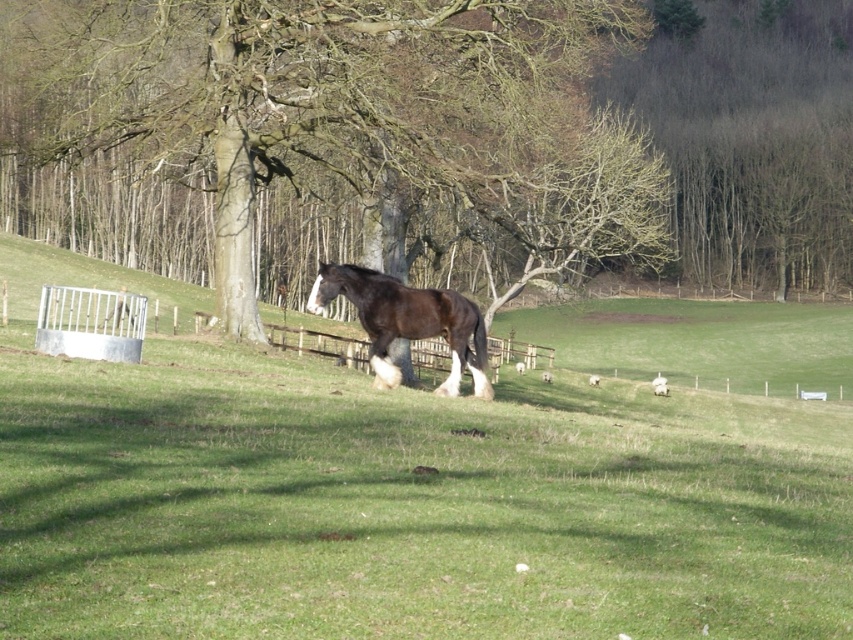
You are standing in the middle of the field and want to walk towards the horse. There are two points marked in the image, point0 at (x=474, y=134) and point1 at (x=410, y=307). Which point should you walk towards to get closer to the horse?

You should walk towards point0 at (x=474, y=134) because it is closer to the horse than point1 at (x=410, y=307).

You are a farmer checking the field. You see the brown bark tree at center and the brown glossy horse at center. Which one is bigger in size?

The brown bark tree at center is larger in size compared to the brown glossy horse at center.